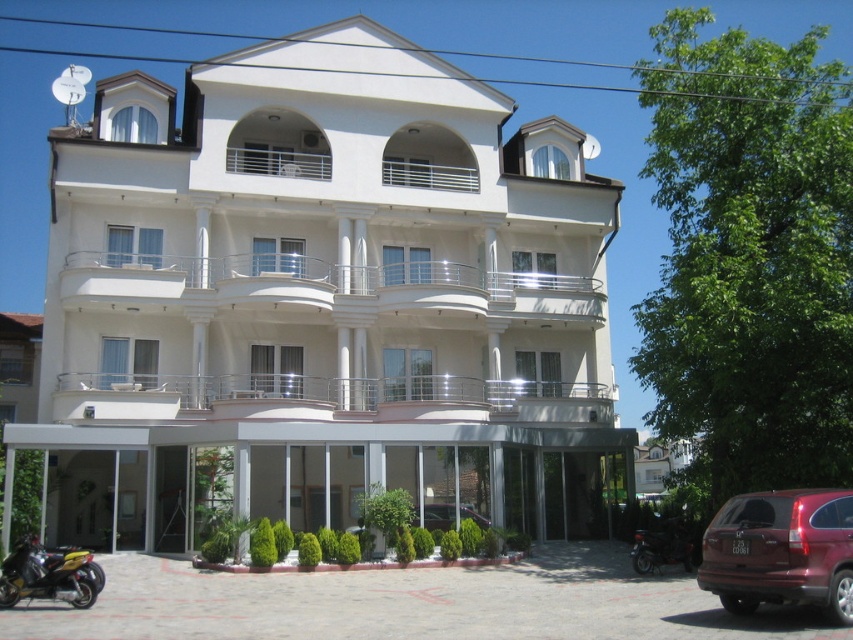
You are a delivery person arriving at the building and need to park your vehicle. You see the maroon matte suv at lower right and the shiny black motorcycle at lower right. Which vehicle is blocking the other one?

The maroon matte suv at lower right is positioned over the shiny black motorcycle at lower right, meaning the suv is blocking the motorcycle.

You are a delivery person standing at the entrance of the building. You need to park your 2.5 meter wide delivery van between the maroon matte suv at lower right and the metallic silver car at center. Is there enough space between them for your van?

The maroon matte suv at lower right and metallic silver car at center are 14.68 meters apart from each other. Since your delivery van is 2.5 meters wide, there is sufficient space between them to park your van.

You are standing at the entrance of the residential building and want to park your car. The maroon matte suv at lower right is currently blocking the parking spot you need. Can you move the suv to the point at coordinates point (x=781, y=552)?

The maroon matte suv at lower right is already located at point (x=781, y=552), so there is no need to move it.